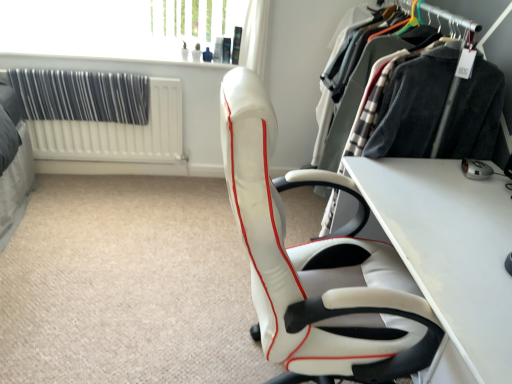
The image size is (512, 384). I want to click on free location above white textured radiator at left (from a real-world perspective), so [x=90, y=72].